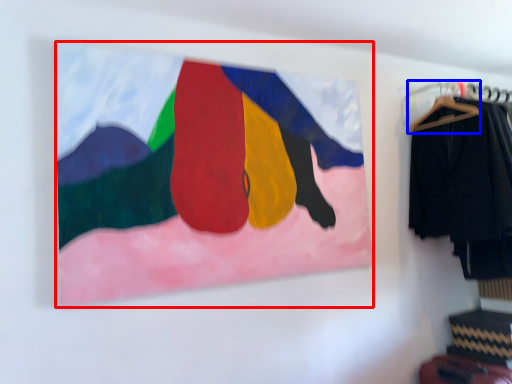
Question: Which of the following is the farthest to the observer, picture frame (highlighted by a red box) or hanger (highlighted by a blue box)?

Choices:
 (A) picture frame
 (B) hanger

Answer: (B)